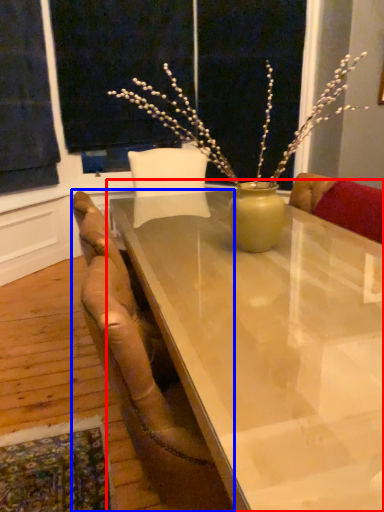
Question: Which point is further to the camera, table (highlighted by a red box) or chair (highlighted by a blue box)?

Choices:
 (A) table
 (B) chair

Answer: (B)